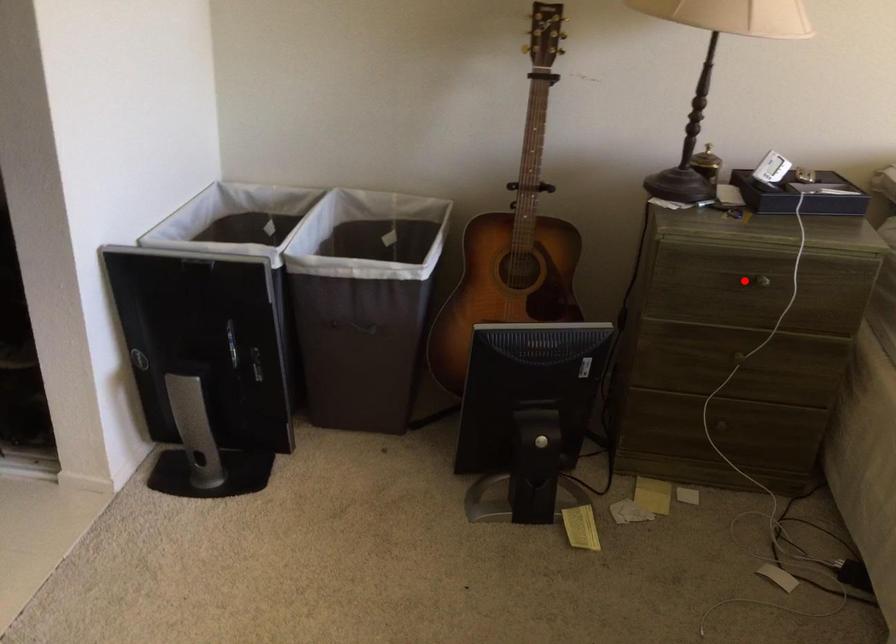
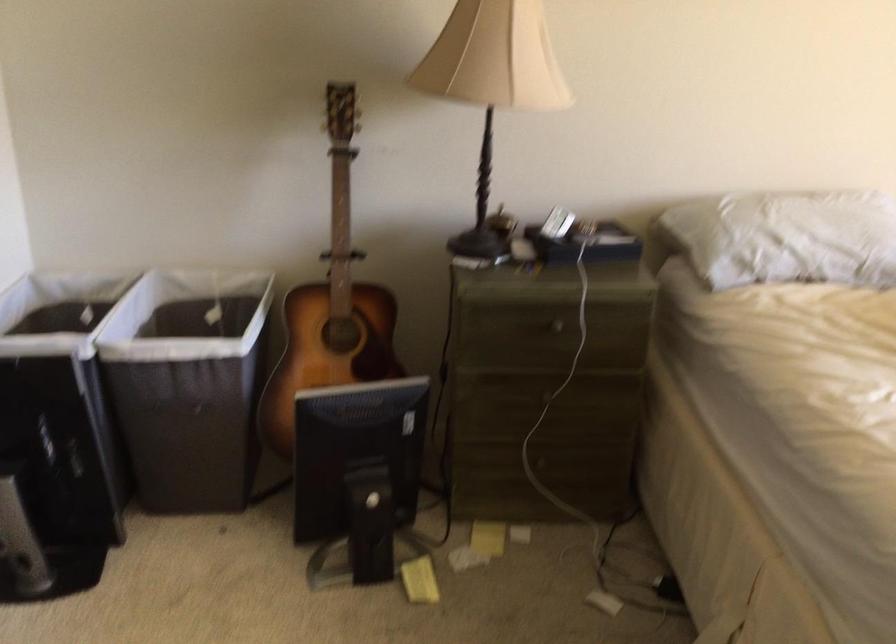
Find the pixel in the second image that matches the highlighted location in the first image.

(545, 328)